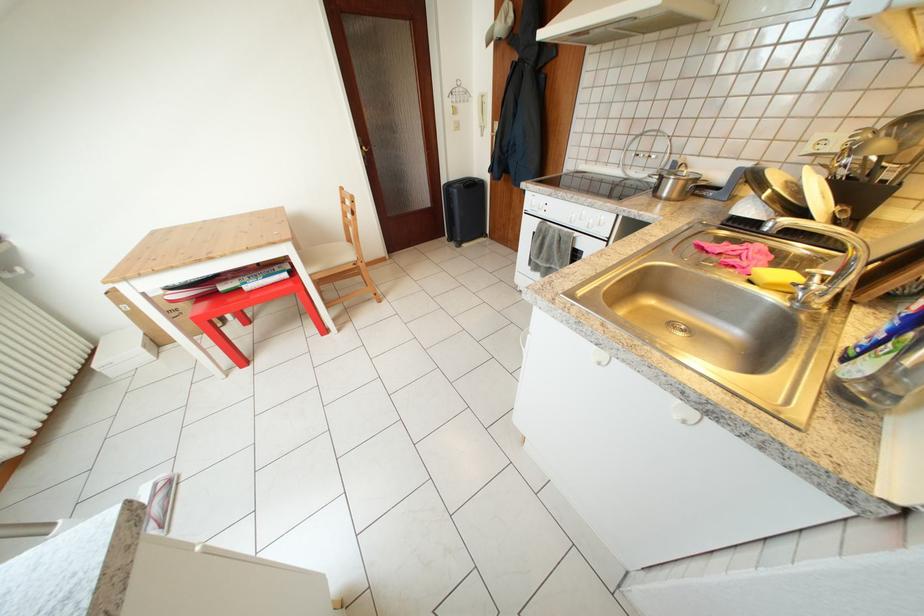
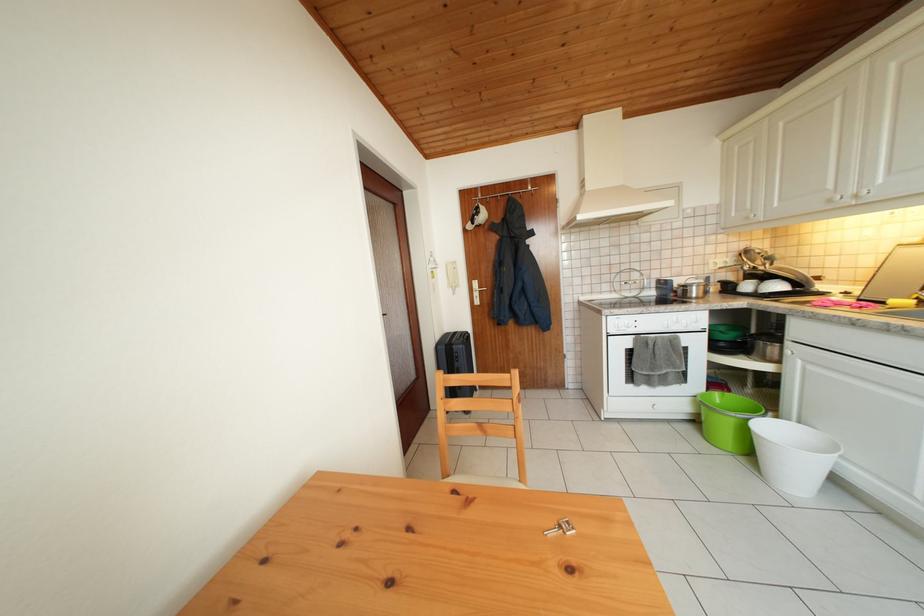
Find the pixel in the second image that matches point 678,187 in the first image.

(702, 294)